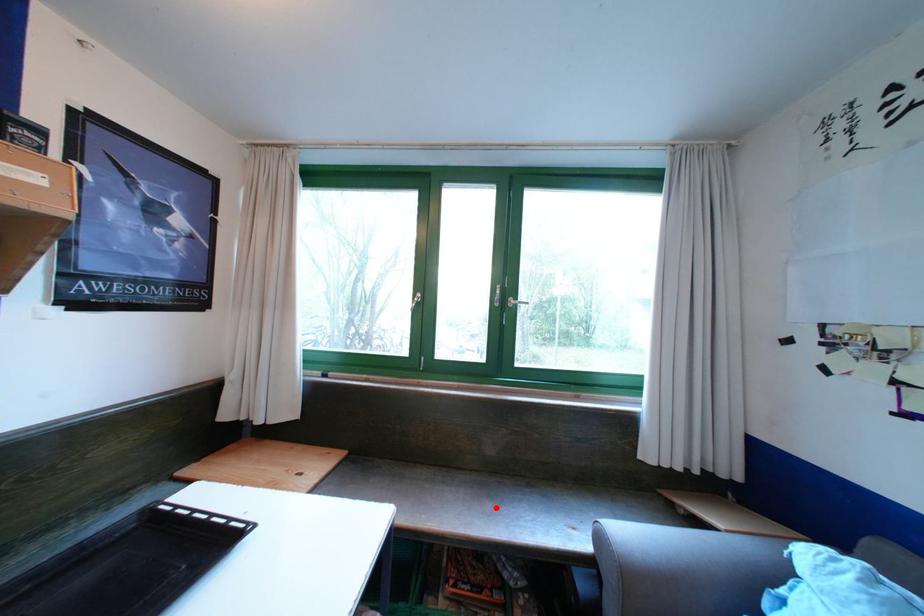
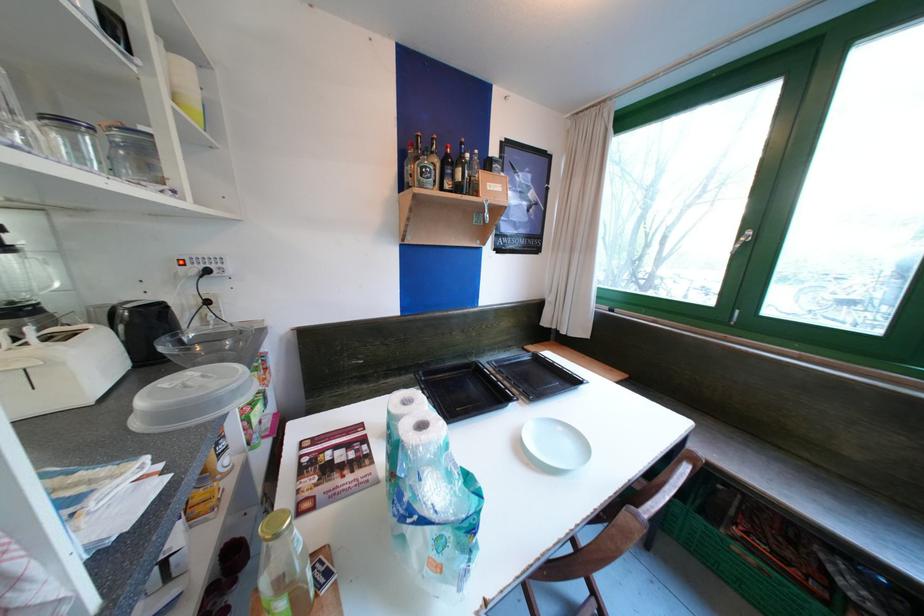
Locate, in the second image, the point that corresponds to the highlighted location in the first image.

(835, 503)